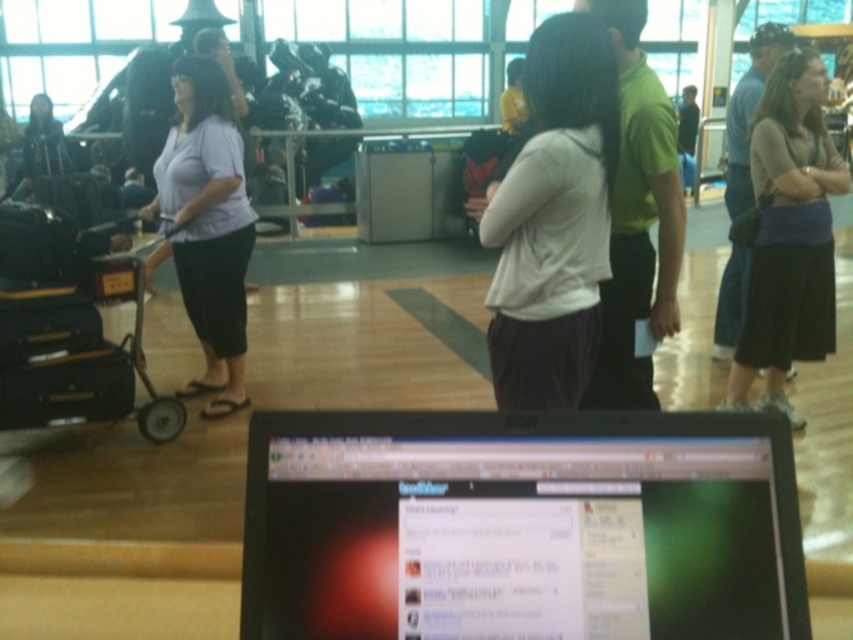
Question: Is white matte shirt at center thinner than black hard suitcase at left?

Choices:
 (A) no
 (B) yes

Answer: (B)

Question: Which point appears closest to the camera in this image?

Choices:
 (A) (233, 253)
 (B) (570, 141)
 (C) (527, 486)
 (D) (33, 314)

Answer: (C)

Question: Among these objects, which one is farthest from the camera?

Choices:
 (A) black hard suitcase at left
 (B) black glossy laptop at center

Answer: (A)

Question: Which point is closer to the camera?

Choices:
 (A) coord(178,218)
 (B) coord(714,477)

Answer: (B)

Question: Does black glossy laptop at center have a greater width compared to matte purple blouse at left?

Choices:
 (A) yes
 (B) no

Answer: (A)

Question: Does white matte shirt at center appear under matte purple blouse at left?

Choices:
 (A) no
 (B) yes

Answer: (B)